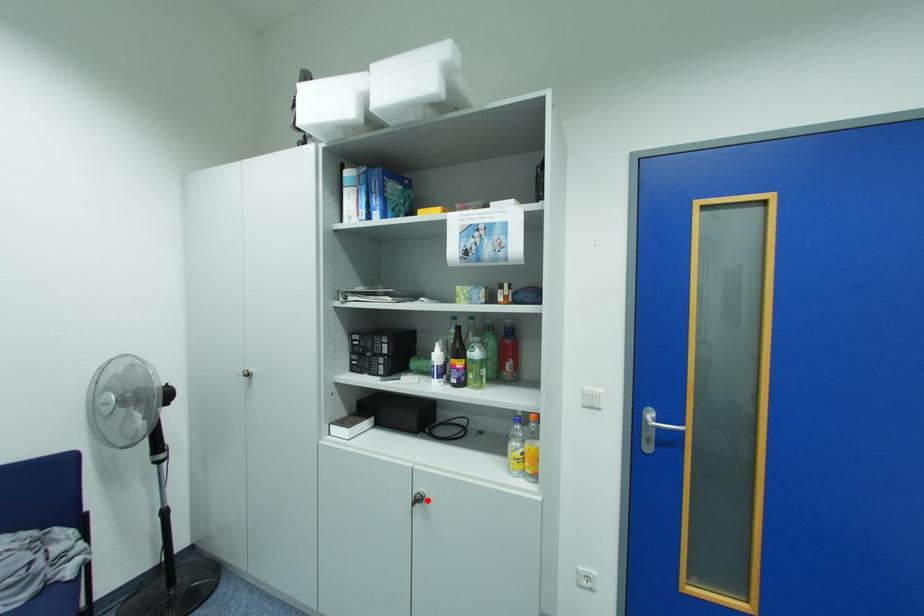
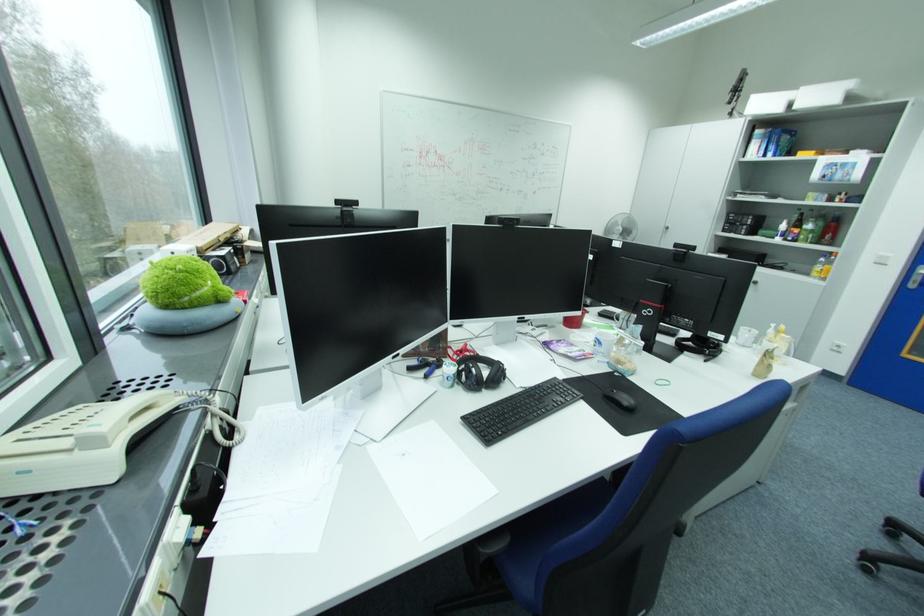
Question: A red point is marked in image1. In image2, is the corresponding 3D point closer to the camera or farther? Reply with the corresponding letter.

Choices:
 (A) The corresponding 3D point is closer.
 (B) The corresponding 3D point is farther.

Answer: (A)